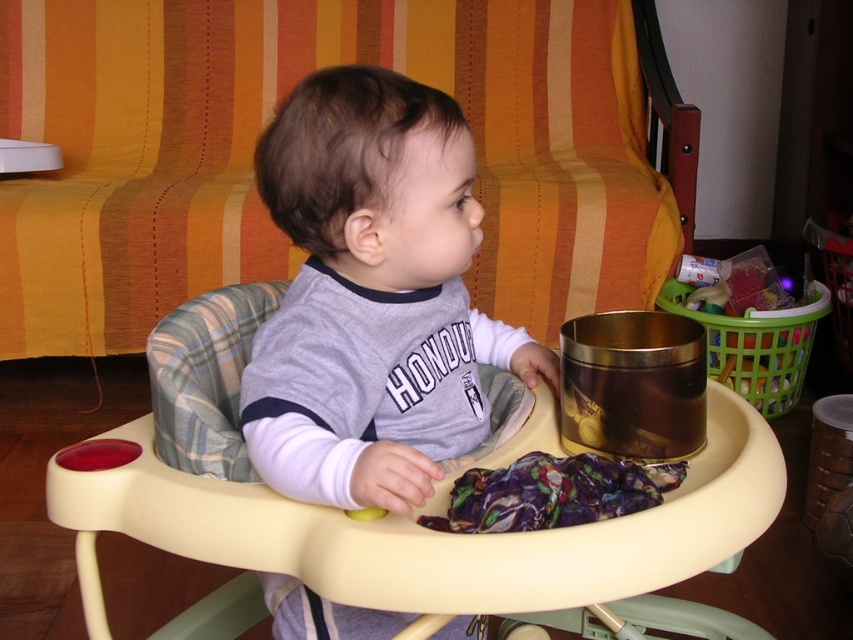
Which is more to the left, beige plastic feeding chair at center or purple fabric at center?

Positioned to the left is beige plastic feeding chair at center.

Can you confirm if beige plastic feeding chair at center is positioned to the left of purple fabric at center?

Yes, beige plastic feeding chair at center is to the left of purple fabric at center.

Is point (119, 524) less distant than point (647, 484)?

No, it is not.

Image resolution: width=853 pixels, height=640 pixels. I want to click on beige plastic feeding chair at center, so click(398, 518).

Is gray cotton shirt at center to the right of purple fabric at center from the viewer's perspective?

Incorrect, gray cotton shirt at center is not on the right side of purple fabric at center.

Is gray cotton shirt at center shorter than purple fabric at center?

A: No.

Does point (456, 198) lie in front of point (422, 516)?

No, (456, 198) is further to viewer.

Locate an element on the screen. gray cotton shirt at center is located at coordinates (372, 296).

Describe the element at coordinates (398, 518) in the screenshot. The height and width of the screenshot is (640, 853). I see `beige plastic feeding chair at center` at that location.

From the picture: Is beige plastic feeding chair at center to the left of gray cotton shirt at center from the viewer's perspective?

In fact, beige plastic feeding chair at center is to the right of gray cotton shirt at center.

What do you see at coordinates (398, 518) in the screenshot? This screenshot has width=853, height=640. I see `beige plastic feeding chair at center` at bounding box center [398, 518].

The height and width of the screenshot is (640, 853). What are the coordinates of `beige plastic feeding chair at center` in the screenshot? It's located at (398, 518).